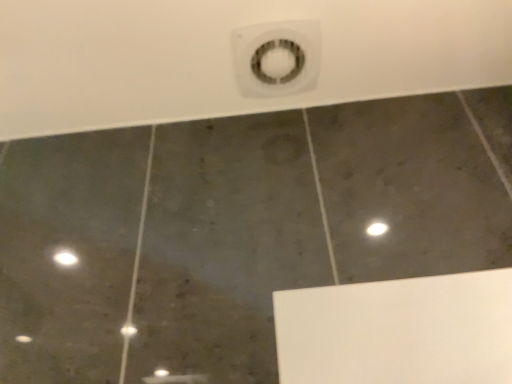
The width and height of the screenshot is (512, 384). What do you see at coordinates (277, 58) in the screenshot?
I see `white matte ring at upper center` at bounding box center [277, 58].

The width and height of the screenshot is (512, 384). I want to click on white matte ring at upper center, so [277, 58].

What is the approximate width of white matte ring at upper center?

white matte ring at upper center is 5.98 inches wide.

Based on the photo, in order to face white matte ring at upper center, should I rotate leftwards or rightwards?

You should look right and rotate roughly 3.086 degrees.

Locate an element on the screen. white matte ring at upper center is located at coordinates (277, 58).